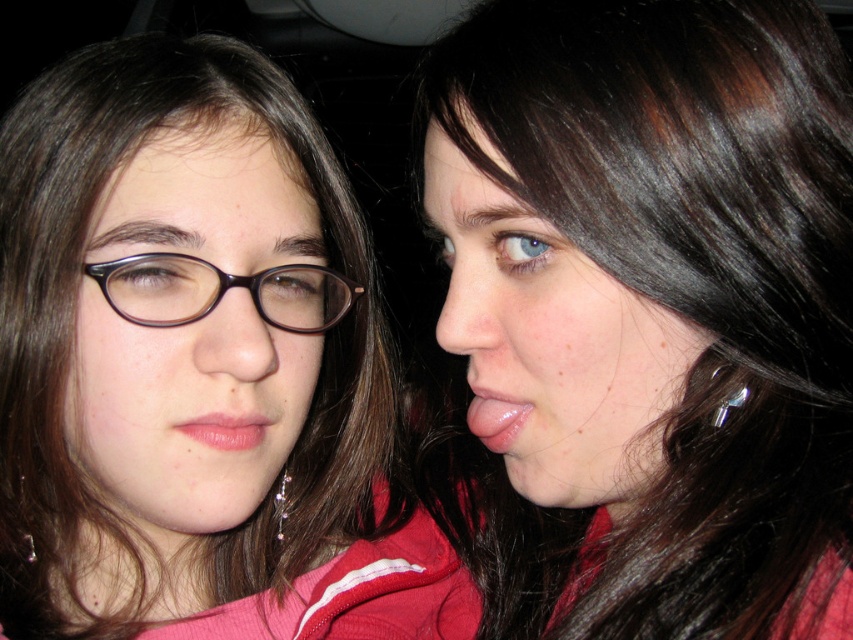
From the picture: Does smooth skin face at center have a smaller size compared to matte brown hair at left?

Actually, smooth skin face at center might be larger than matte brown hair at left.

Between smooth skin face at center and matte brown hair at left, which one has more height?

With more height is smooth skin face at center.

Image resolution: width=853 pixels, height=640 pixels. In order to click on smooth skin face at center in this screenshot , I will do `click(653, 308)`.

From the picture: Which is more to the right, smooth skin face at center or matte brown glasses at left?

smooth skin face at center is more to the right.

Which is in front, point (701, 486) or point (260, 289)?

Point (701, 486) is in front.

Where is `smooth skin face at center`? smooth skin face at center is located at coordinates (653, 308).

From the picture: Is matte brown hair at left to the right of matte brown glasses at left from the viewer's perspective?

No, matte brown hair at left is not to the right of matte brown glasses at left.

Is matte brown hair at left closer to the viewer compared to matte brown glasses at left?

That is True.

This screenshot has height=640, width=853. Describe the element at coordinates (177, 340) in the screenshot. I see `matte brown hair at left` at that location.

At what (x,y) coordinates should I click in order to perform the action: click on matte brown hair at left. Please return your answer as a coordinate pair (x, y). The image size is (853, 640). Looking at the image, I should click on (177, 340).